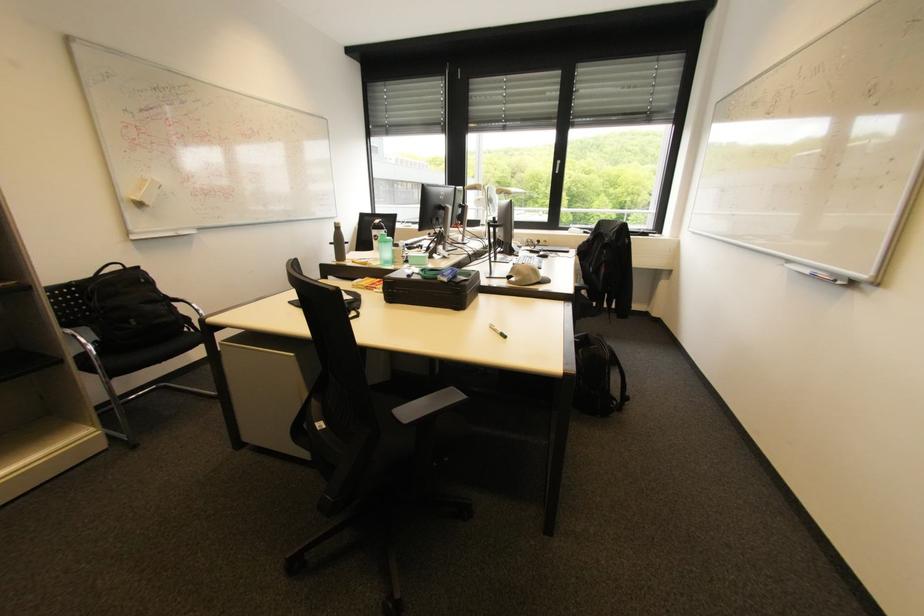
Where would you lift the teal water bottle? Please return your answer as a coordinate pair (x, y).

(384, 249)